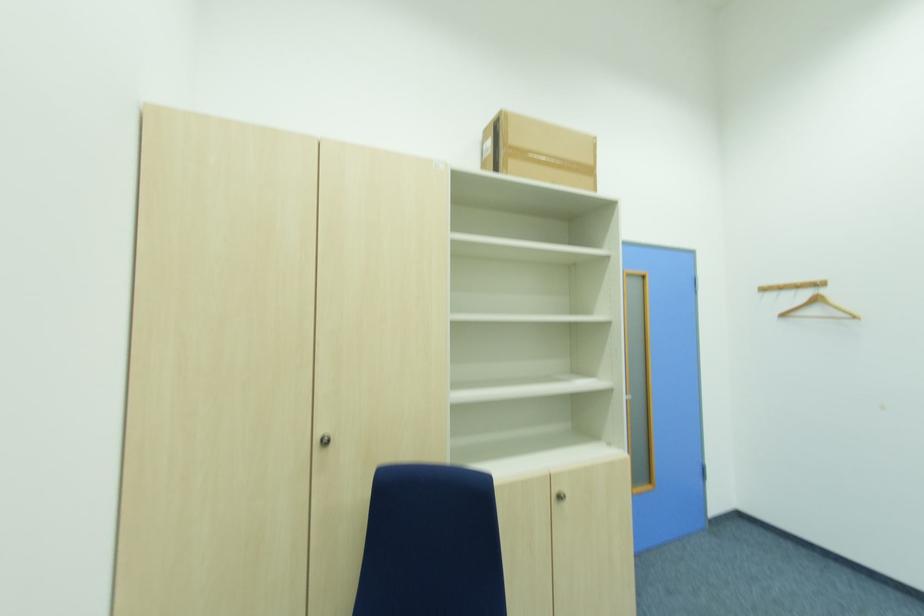
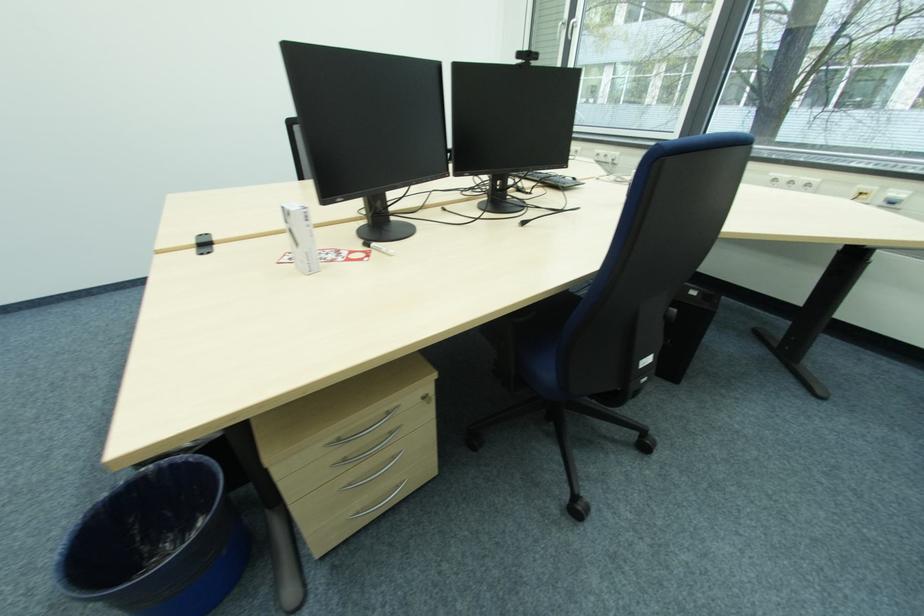
How did the camera likely rotate?

The rotation direction of the camera is right-down.